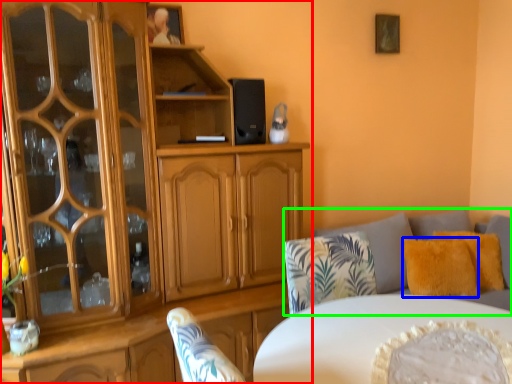
Question: Estimate the real-world distances between objects in this image. Which object is closer to cabinetry (highlighted by a red box), pillow (highlighted by a blue box) or studio couch (highlighted by a green box)?

Choices:
 (A) pillow
 (B) studio couch

Answer: (B)